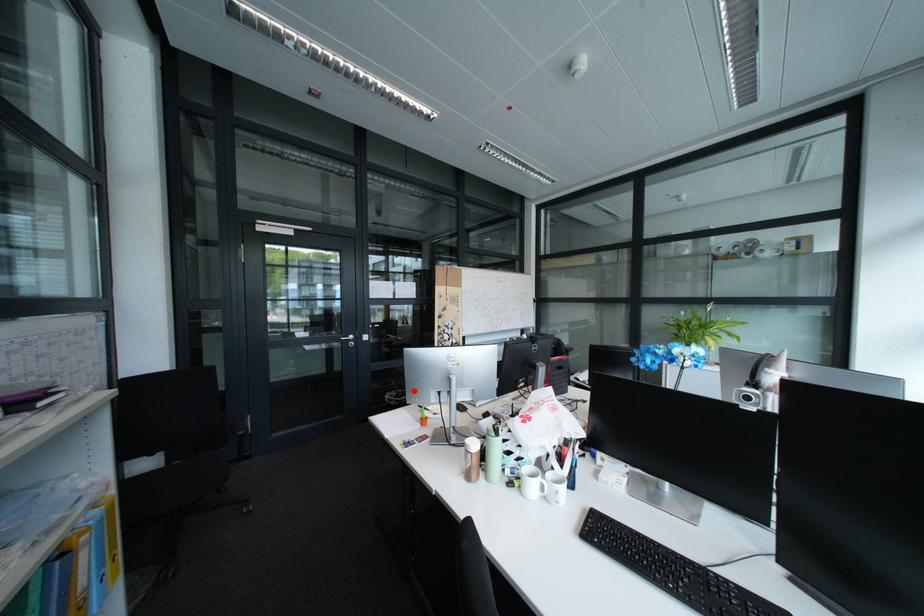
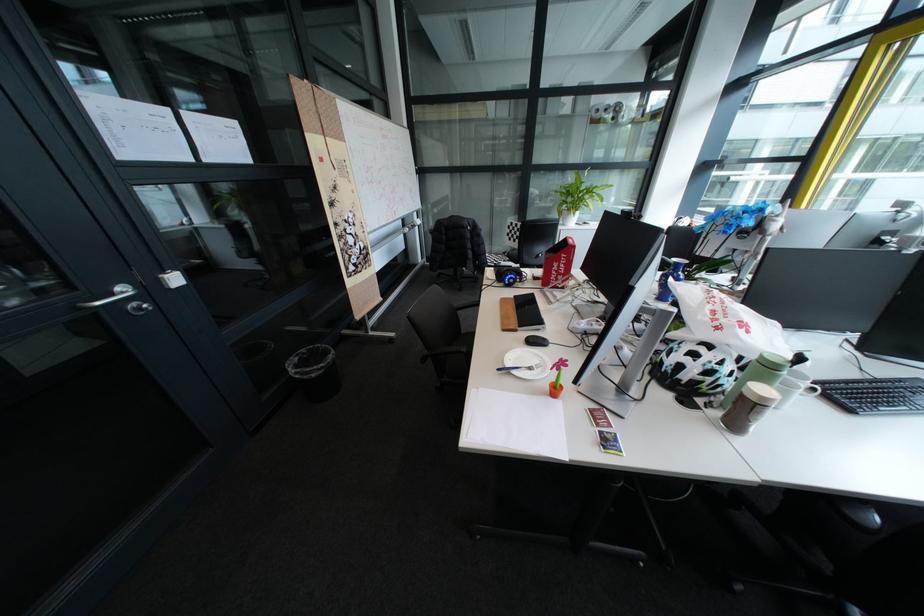
Where in the second image is the point corresponding to the highlighted location from the first image?

(317, 351)